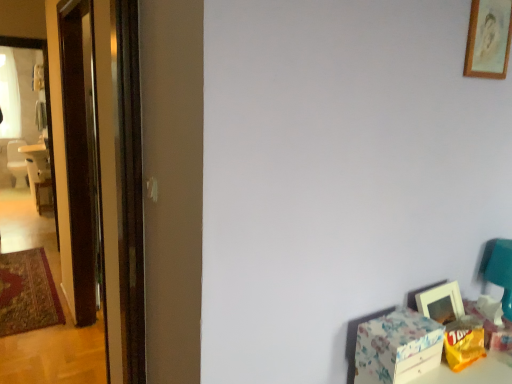
Question: Would you consider matte white picture frame at lower right, which ranks as the first picture frame in bottom-to-top order, to be distant from transparent glass screen door at left?

Choices:
 (A) no
 (B) yes

Answer: (B)

Question: Is matte white picture frame at lower right, which ranks as the first picture frame in bottom-to-top order, touching transparent glass screen door at left?

Choices:
 (A) yes
 (B) no

Answer: (B)

Question: From a real-world perspective, is matte white picture frame at lower right, which ranks as the first picture frame in bottom-to-top order, on top of transparent glass screen door at left?

Choices:
 (A) no
 (B) yes

Answer: (A)

Question: Considering the relative positions of matte white picture frame at lower right, the 2th picture frame in the top-to-bottom sequence, and transparent glass screen door at left in the image provided, is matte white picture frame at lower right, the 2th picture frame in the top-to-bottom sequence, in front of transparent glass screen door at left?

Choices:
 (A) yes
 (B) no

Answer: (A)

Question: From a real-world perspective, is matte white picture frame at lower right, which ranks as the first picture frame in bottom-to-top order, under transparent glass screen door at left?

Choices:
 (A) no
 (B) yes

Answer: (B)

Question: Would you say matte white picture frame at lower right, which ranks as the first picture frame in bottom-to-top order, is inside or outside white plastic chair at left?

Choices:
 (A) outside
 (B) inside

Answer: (A)

Question: From their relative heights in the image, would you say matte white picture frame at lower right, the 2th picture frame in the top-to-bottom sequence, is taller or shorter than white plastic chair at left?

Choices:
 (A) tall
 (B) short

Answer: (B)

Question: From a real-world perspective, is matte white picture frame at lower right, the 2th picture frame in the top-to-bottom sequence, above or below white plastic chair at left?

Choices:
 (A) below
 (B) above

Answer: (B)

Question: From the image's perspective, is matte white picture frame at lower right, the 2th picture frame in the top-to-bottom sequence, above or below white plastic chair at left?

Choices:
 (A) below
 (B) above

Answer: (A)

Question: Considering the positions of wooden frame at upper right, the first picture frame from the top, and yellow paper bag at lower right, the 1th box in the right-to-left sequence, in the image, is wooden frame at upper right, the first picture frame from the top, wider or thinner than yellow paper bag at lower right, the 1th box in the right-to-left sequence,?

Choices:
 (A) wide
 (B) thin

Answer: (B)

Question: Is wooden frame at upper right, marked as the second picture frame in a bottom-to-top arrangement, situated inside yellow paper bag at lower right, the 1th box in the right-to-left sequence, or outside?

Choices:
 (A) inside
 (B) outside

Answer: (B)

Question: Considering the positions of point (478, 64) and point (450, 337), is point (478, 64) closer or farther from the camera than point (450, 337)?

Choices:
 (A) closer
 (B) farther

Answer: (B)

Question: Based on their sizes in the image, would you say wooden frame at upper right, the first picture frame from the top, is bigger or smaller than yellow paper bag at lower right, the 1th box in the right-to-left sequence?

Choices:
 (A) small
 (B) big

Answer: (A)

Question: From a real-world perspective, is matte white picture frame at lower right, the 2th picture frame in the top-to-bottom sequence, above or below yellow paper bag at lower right, the 1th box in the right-to-left sequence?

Choices:
 (A) below
 (B) above

Answer: (B)

Question: Choose the correct answer: Is matte white picture frame at lower right, which ranks as the first picture frame in bottom-to-top order, inside yellow paper bag at lower right, positioned as the 2th box in left-to-right order, or outside it?

Choices:
 (A) outside
 (B) inside

Answer: (A)